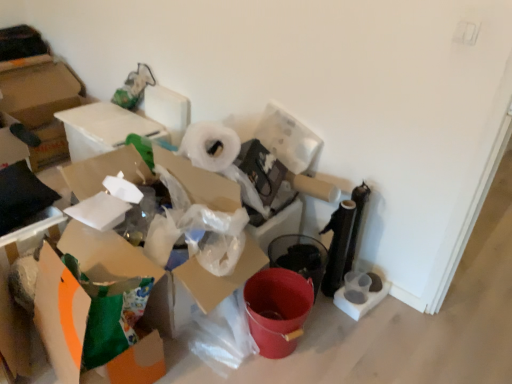
Question: Is transparent plastic toilet paper at lower right positioned before orange matte cardboard box at lower left, placed as the first cardboard box when sorted from front to back?

Choices:
 (A) yes
 (B) no

Answer: (B)

Question: Considering the relative positions of transparent plastic toilet paper at lower right and orange matte cardboard box at lower left, placed as the first cardboard box when sorted from front to back, in the image provided, is transparent plastic toilet paper at lower right behind orange matte cardboard box at lower left, placed as the first cardboard box when sorted from front to back,?

Choices:
 (A) no
 (B) yes

Answer: (B)

Question: Is transparent plastic toilet paper at lower right turned away from orange matte cardboard box at lower left, arranged as the 3th cardboard box when viewed from the back?

Choices:
 (A) yes
 (B) no

Answer: (B)

Question: Considering the relative sizes of transparent plastic toilet paper at lower right and orange matte cardboard box at lower left, placed as the first cardboard box when sorted from front to back, in the image provided, is transparent plastic toilet paper at lower right wider than orange matte cardboard box at lower left, placed as the first cardboard box when sorted from front to back,?

Choices:
 (A) yes
 (B) no

Answer: (B)

Question: Can you confirm if transparent plastic toilet paper at lower right is thinner than orange matte cardboard box at lower left, placed as the first cardboard box when sorted from front to back?

Choices:
 (A) no
 (B) yes

Answer: (B)

Question: Is transparent plastic toilet paper at lower right smaller than orange matte cardboard box at lower left, placed as the first cardboard box when sorted from front to back?

Choices:
 (A) yes
 (B) no

Answer: (A)

Question: Can white cardboard box at upper left, marked as the 1th cardboard box in a back-to-front arrangement, be found inside transparent plastic toilet paper at lower right?

Choices:
 (A) no
 (B) yes

Answer: (A)

Question: From the image's perspective, would you say transparent plastic toilet paper at lower right is shown under white cardboard box at upper left, marked as the 3th cardboard box in a front-to-back arrangement?

Choices:
 (A) yes
 (B) no

Answer: (A)

Question: Can you confirm if transparent plastic toilet paper at lower right is taller than white cardboard box at upper left, marked as the 3th cardboard box in a front-to-back arrangement?

Choices:
 (A) yes
 (B) no

Answer: (B)

Question: Does transparent plastic toilet paper at lower right have a smaller size compared to white cardboard box at upper left, marked as the 3th cardboard box in a front-to-back arrangement?

Choices:
 (A) no
 (B) yes

Answer: (B)

Question: Would you say transparent plastic toilet paper at lower right is outside white cardboard box at upper left, marked as the 1th cardboard box in a back-to-front arrangement?

Choices:
 (A) yes
 (B) no

Answer: (A)

Question: Is the surface of transparent plastic toilet paper at lower right in direct contact with white cardboard box at upper left, marked as the 3th cardboard box in a front-to-back arrangement?

Choices:
 (A) yes
 (B) no

Answer: (B)

Question: Can you confirm if white cardboard box at upper left, marked as the 3th cardboard box in a front-to-back arrangement, is thinner than orange matte cardboard box at lower left, which is the 2th cardboard box in back-to-front order?

Choices:
 (A) yes
 (B) no

Answer: (B)